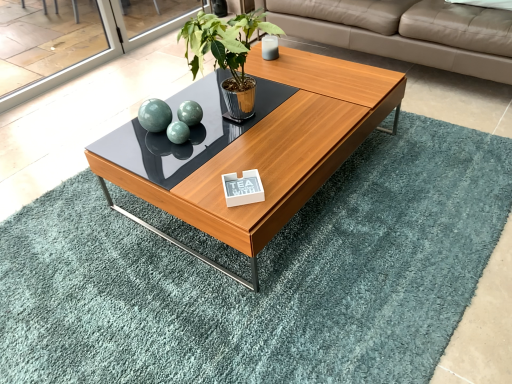
Where is `free space to the left of white glossy plaque at center`? This screenshot has height=384, width=512. free space to the left of white glossy plaque at center is located at coordinates (195, 189).